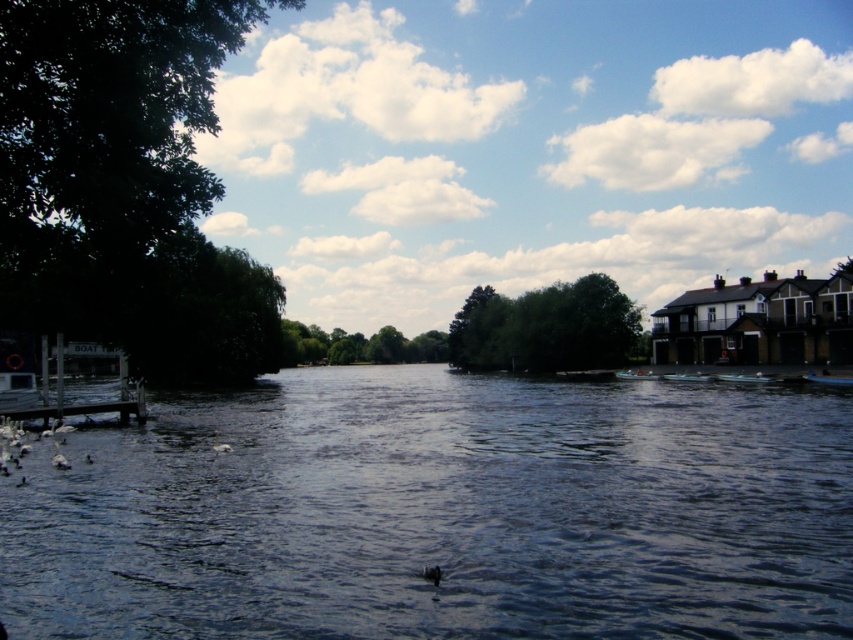
You are standing at the riverside and want to reach a specific location. You see two points marked in the image. Which point is closer to you, point (82, 406) or point (822, 378)?

Point (82, 406) is closer to the viewer than point (822, 378).

You are standing at the wooden dock on the left side of the riverside scene. You notice two points in the image labeled as point 1 and point 2. Point 1 is located at coordinates point (842, 381) and point 2 is at point (683, 378). Which point is closer to you, the observer?

Point 1 is closer to you because it is in front of point 2.